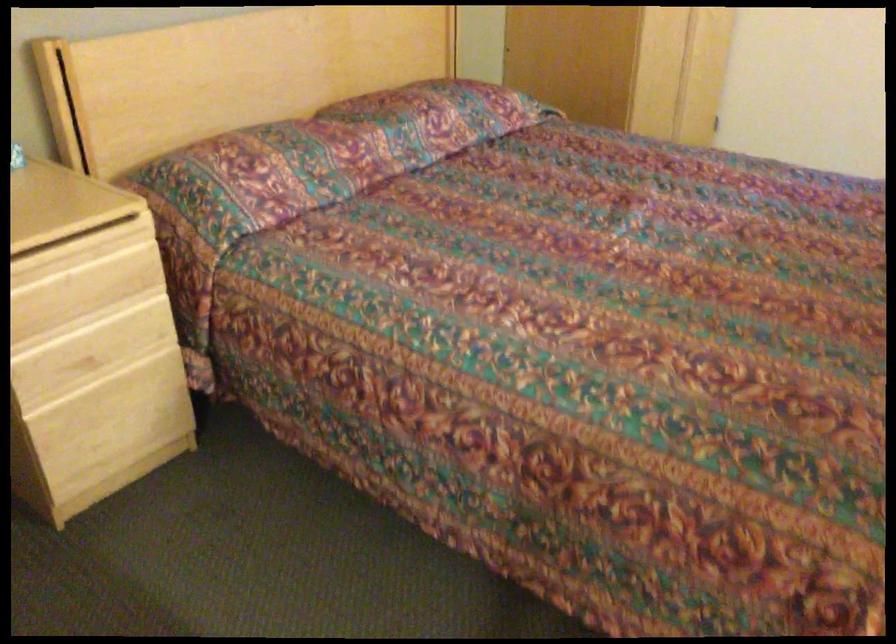
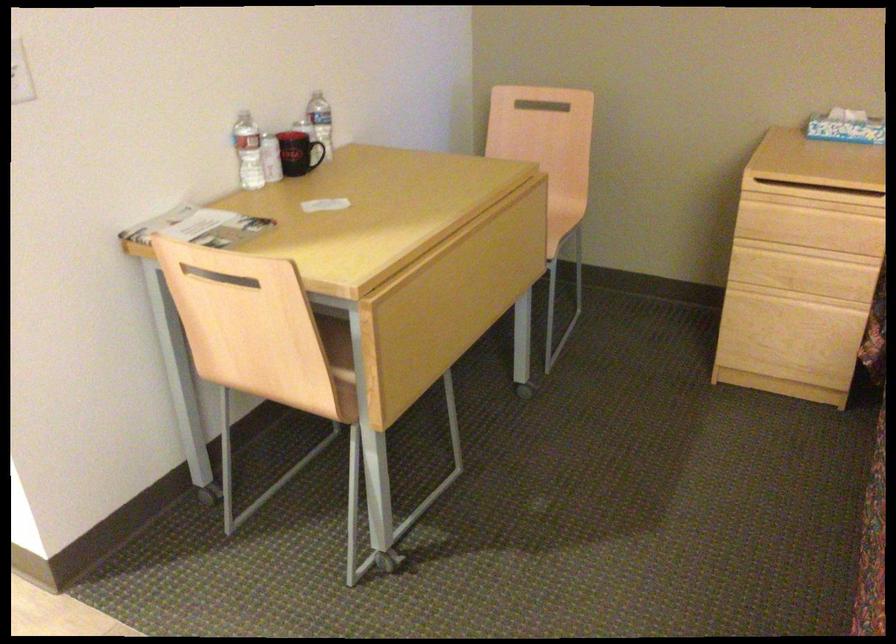
The point at (91, 316) is marked in the first image. Where is the corresponding point in the second image?

(810, 251)